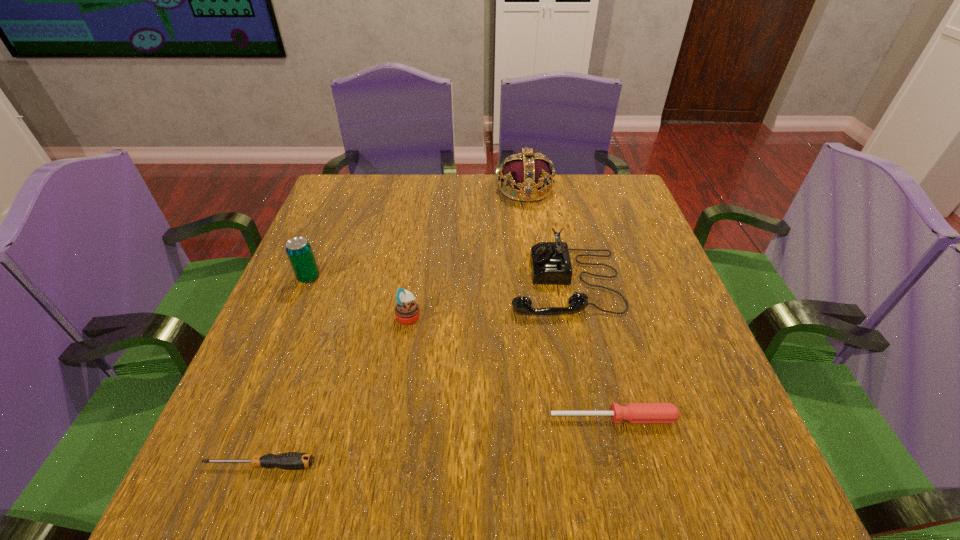
The width and height of the screenshot is (960, 540). Identify the location of blank area located on the front of the tallest object. (532, 239).

Identify the location of free space located on the front of the beer can. (292, 318).

Locate an element on the screen. free space located 0.090m on the dial of the telephone is located at coordinates (470, 282).

Image resolution: width=960 pixels, height=540 pixels. I want to click on vacant region located on the dial of the telephone, so click(x=488, y=282).

Locate an element on the screen. Image resolution: width=960 pixels, height=540 pixels. free space located 0.200m on the dial of the telephone is located at coordinates (422, 282).

The image size is (960, 540). Find the location of `vacant space situated 0.380m on the front-facing side of the fourth tallest object`. vacant space situated 0.380m on the front-facing side of the fourth tallest object is located at coordinates (599, 316).

At what (x,y) coordinates should I click in order to perform the action: click on free point located on the left of the second nearest object. Please return your answer as a coordinate pair (x, y). Looking at the image, I should click on (482, 418).

Image resolution: width=960 pixels, height=540 pixels. I want to click on vacant region located on the back of the nearest object, so click(276, 423).

The image size is (960, 540). Identify the location of object present at the far edge. (524, 172).

Locate an element on the screen. object that is at the near edge is located at coordinates (291, 460).